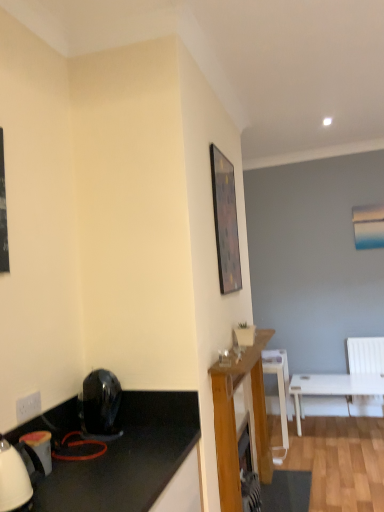
Find the location of a particular element. This screenshot has height=512, width=384. wooden framed picture at upper center is located at coordinates (225, 222).

Where is `white glossy kettle at lower left, arranged as the 1th appliance when viewed from the front`? Image resolution: width=384 pixels, height=512 pixels. white glossy kettle at lower left, arranged as the 1th appliance when viewed from the front is located at coordinates (40, 447).

This screenshot has height=512, width=384. What do you see at coordinates (235, 423) in the screenshot? I see `wooden mantelpiece at center` at bounding box center [235, 423].

Where is `wooden mantelpiece at center`? Image resolution: width=384 pixels, height=512 pixels. wooden mantelpiece at center is located at coordinates (235, 423).

The height and width of the screenshot is (512, 384). What do you see at coordinates (28, 407) in the screenshot?
I see `white plastic power outlet at lower left` at bounding box center [28, 407].

Identify the location of white glossy chair at center. (279, 383).

I want to click on wooden framed picture at upper center, so click(x=225, y=222).

From a real-world perspective, relative to wooden framed picture at upper center, is transparent glass coffee cup at center vertically above or below?

In terms of real-world spatial position, transparent glass coffee cup at center is below wooden framed picture at upper center.

Could you tell me if transparent glass coffee cup at center is turned towards wooden framed picture at upper center?

No, transparent glass coffee cup at center is not oriented towards wooden framed picture at upper center.

Which object is thinner, transparent glass coffee cup at center or wooden framed picture at upper center?

wooden framed picture at upper center.

Between transparent glass coffee cup at center and wooden framed picture at upper center, which one has more height?

wooden framed picture at upper center is taller.

From a real-world perspective, which object stands above the other?

wooden framed picture at upper center.

Considering the relative sizes of wooden framed picture at upper center and white glossy chair at center in the image provided, is wooden framed picture at upper center thinner than white glossy chair at center?

Yes, wooden framed picture at upper center is thinner than white glossy chair at center.

Between wooden framed picture at upper center and white glossy chair at center, which one is positioned in front?

Positioned in front is wooden framed picture at upper center.

Which object is positioned more to the left, wooden framed picture at upper center or white glossy chair at center?

From the viewer's perspective, wooden framed picture at upper center appears more on the left side.

Would you consider white plastic power outlet at lower left to be distant from white glossy kettle at lower left, which appears as the 2th appliance when viewed from the right?

No, white plastic power outlet at lower left is in close proximity to white glossy kettle at lower left, which appears as the 2th appliance when viewed from the right.

You are a GUI agent. You are given a task and a screenshot of the screen. Output one action in this format:
    pyautogui.click(x=<x>, y=<y>)
    Task: Click on the appliance that is the 2nd one when counting downward from the white plastic power outlet at lower left (from the image's perspective)
    
    Given the screenshot: What is the action you would take?
    pyautogui.click(x=40, y=447)

From the picture: Which of these two, white plastic power outlet at lower left or white glossy kettle at lower left, which appears as the 2th appliance when viewed from the right, stands shorter?

white plastic power outlet at lower left.

From a real-world perspective, is white plastic power outlet at lower left physically above white glossy kettle at lower left, which appears as the 2th appliance when viewed from the right?

Yes, from a real-world perspective, white plastic power outlet at lower left is over white glossy kettle at lower left, which appears as the 2th appliance when viewed from the right

Where is `the 1st appliance in front of the wooden framed picture at upper center, starting your count from the anchor`? Image resolution: width=384 pixels, height=512 pixels. the 1st appliance in front of the wooden framed picture at upper center, starting your count from the anchor is located at coordinates (100, 404).

From the image's perspective, between black glossy hairdryer at lower left, which is the first appliance in right-to-left order, and wooden framed picture at upper center, which one is located above?

From the image's view, wooden framed picture at upper center is above.

Between black glossy hairdryer at lower left, which is the first appliance in right-to-left order, and wooden framed picture at upper center, which one has more height?

With more height is wooden framed picture at upper center.

Is black glossy hairdryer at lower left, which ranks as the first appliance in back-to-front order, not within wooden framed picture at upper center?

Absolutely, black glossy hairdryer at lower left, which ranks as the first appliance in back-to-front order, is external to wooden framed picture at upper center.

Can you confirm if white plastic power outlet at lower left is positioned to the right of wooden mantelpiece at center?

Incorrect, white plastic power outlet at lower left is not on the right side of wooden mantelpiece at center.

How many degrees apart are the facing directions of white plastic power outlet at lower left and wooden mantelpiece at center?

0.456 degrees.

From a real-world perspective, is white plastic power outlet at lower left located beneath wooden mantelpiece at center?

No, from a real-world perspective, white plastic power outlet at lower left is not under wooden mantelpiece at center.

In the image, is white glossy chair at center positioned in front of or behind white glossy kettle at lower left, which is counted as the 1th appliance, starting from the left?

In the image, white glossy chair at center appears behind white glossy kettle at lower left, which is counted as the 1th appliance, starting from the left.

Is point (285, 433) closer to camera compared to point (33, 439)?

No, it is behind (33, 439).

From a real-world perspective, count 1st appliances upward from the white glossy chair at center and point to it. Please provide its 2D coordinates.

[(40, 447)]

From the image's perspective, would you say white glossy chair at center is shown under white glossy kettle at lower left, arranged as the 1th appliance when viewed from the front?

Yes, from the image's perspective, white glossy chair at center is below white glossy kettle at lower left, arranged as the 1th appliance when viewed from the front.

Can you see transparent glass coffee cup at center touching white glossy kettle at lower left, marked as the 2th appliance in a back-to-front arrangement?

No, transparent glass coffee cup at center is not making contact with white glossy kettle at lower left, marked as the 2th appliance in a back-to-front arrangement.

Does transparent glass coffee cup at center turn towards white glossy kettle at lower left, arranged as the 1th appliance when viewed from the front?

No, transparent glass coffee cup at center is not aimed at white glossy kettle at lower left, arranged as the 1th appliance when viewed from the front.

How much distance is there between transparent glass coffee cup at center and white glossy kettle at lower left, marked as the 2th appliance in a back-to-front arrangement?

transparent glass coffee cup at center is 37.13 inches away from white glossy kettle at lower left, marked as the 2th appliance in a back-to-front arrangement.

This screenshot has width=384, height=512. I want to click on coffee cup lying on the left of wooden framed picture at upper center, so [224, 358].

The width and height of the screenshot is (384, 512). What are the coordinates of `picture frame that is in front of the white glossy chair at center` in the screenshot? It's located at (225, 222).

From the image, which object appears to be farther from wooden mantelpiece at center, white plastic power outlet at lower left or black glossy hairdryer at lower left, the 2th appliance when ordered from left to right?

The object further to wooden mantelpiece at center is white plastic power outlet at lower left.

Considering their positions, is white glossy chair at center positioned closer to wooden framed picture at upper center than white plastic power outlet at lower left?

The object closer to wooden framed picture at upper center is white plastic power outlet at lower left.

Looking at the image, which one is located closer to wooden mantelpiece at center, white glossy kettle at lower left, arranged as the 1th appliance when viewed from the front, or white plastic power outlet at lower left?

white glossy kettle at lower left, arranged as the 1th appliance when viewed from the front.

Based on the photo, estimate the real-world distances between objects in this image. Which object is closer to black glossy hairdryer at lower left, the second appliance from the front, white plastic power outlet at lower left or wooden mantelpiece at center?

white plastic power outlet at lower left is positioned closer to the anchor black glossy hairdryer at lower left, the second appliance from the front.

Which object lies nearer to the anchor point transparent glass coffee cup at center, wooden framed picture at upper center or white glossy chair at center?

wooden framed picture at upper center.

Which object lies further to the anchor point wooden mantelpiece at center, white plastic power outlet at lower left or white glossy kettle at lower left, arranged as the 1th appliance when viewed from the front?

white plastic power outlet at lower left.

From the image, which object appears to be farther from black glossy hairdryer at lower left, the 2th appliance when ordered from left to right, white glossy kettle at lower left, which is counted as the 1th appliance, starting from the left, or wooden mantelpiece at center?

The object further to black glossy hairdryer at lower left, the 2th appliance when ordered from left to right, is wooden mantelpiece at center.

Considering their positions, is black glossy hairdryer at lower left, which ranks as the first appliance in back-to-front order, positioned further to wooden framed picture at upper center than transparent glass coffee cup at center?

The object further to wooden framed picture at upper center is black glossy hairdryer at lower left, which ranks as the first appliance in back-to-front order.

Where is `picture frame between wooden mantelpiece at center and white glossy chair at center in the front-back direction`? This screenshot has height=512, width=384. picture frame between wooden mantelpiece at center and white glossy chair at center in the front-back direction is located at coordinates (225, 222).

The height and width of the screenshot is (512, 384). What are the coordinates of `coffee cup positioned between black glossy hairdryer at lower left, which ranks as the first appliance in back-to-front order, and white glossy chair at center from near to far` in the screenshot? It's located at (224, 358).

This screenshot has height=512, width=384. What are the coordinates of `picture frame between transparent glass coffee cup at center and white glossy chair at center along the z-axis` in the screenshot? It's located at 225,222.

You are a GUI agent. You are given a task and a screenshot of the screen. Output one action in this format:
    pyautogui.click(x=<x>, y=<y>)
    Task: Click on the appliance between wooden framed picture at upper center and white glossy kettle at lower left, arranged as the 1th appliance when viewed from the front, in the up-down direction
    
    Given the screenshot: What is the action you would take?
    pyautogui.click(x=100, y=404)